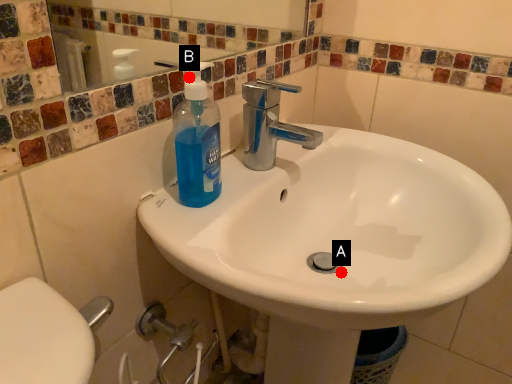
Question: Two points are circled on the image, labeled by A and B beside each circle. Which of the following is the farthest from the observer?

Choices:
 (A) A is further
 (B) B is further

Answer: (A)